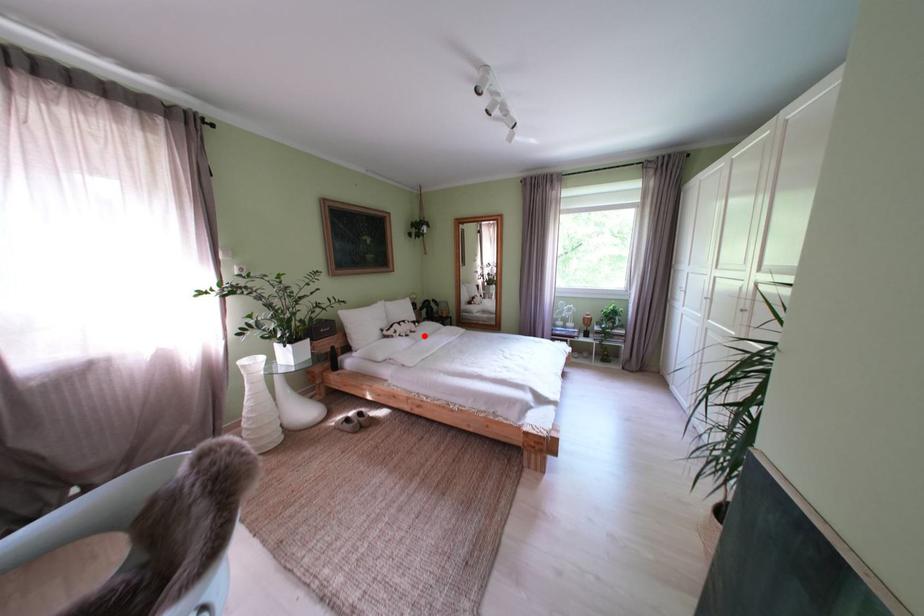
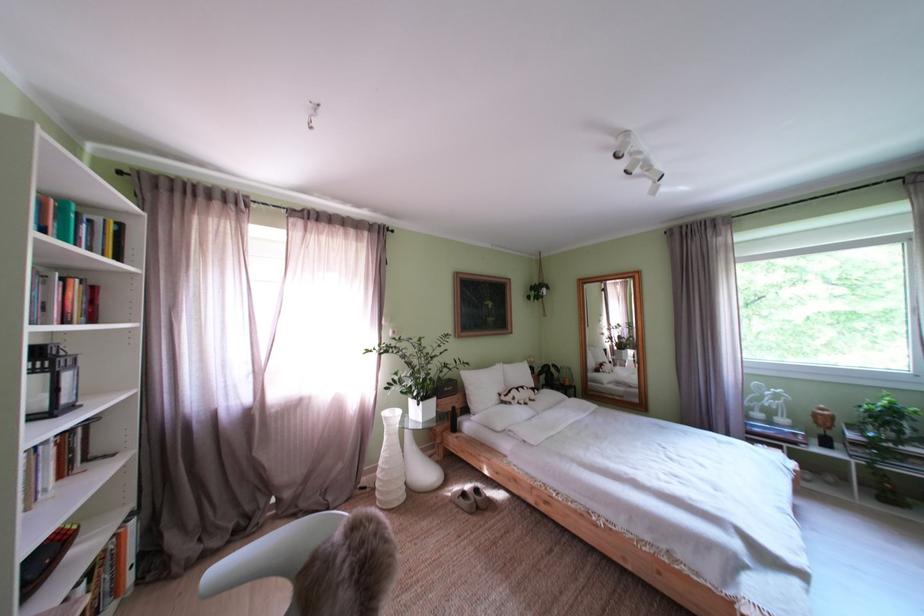
Question: I am providing you with two images of the same scene from different viewpoints. A red point is marked on the first image. At the location where the point appears in image 1, is it still visible in image 2?

Choices:
 (A) Yes
 (B) No

Answer: (A)